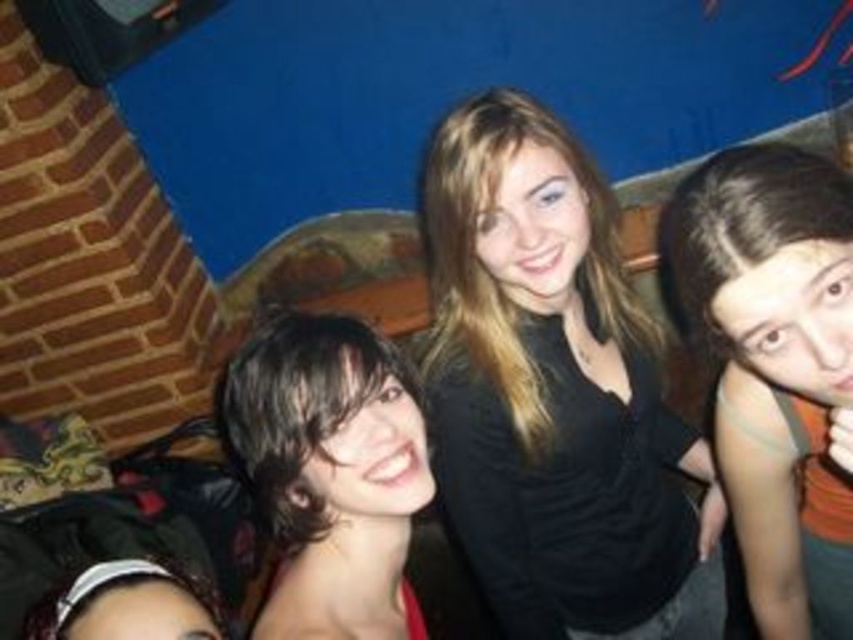
You are at a party and want to find the person with dark brown hair at right. Which direction should you look from the person with matte black hair at lower left?

The dark brown hair at right is located to the right of the matte black hair at lower left, so you should look to the right direction from the matte black hair at lower left to find the dark brown hair at right.

You are standing in the room and want to take a photo of the dark brown hair at right. Where should you aim your camera to capture it?

You should aim your camera at point 0.575 on the horizontal axis and 0.911 on the vertical axis to capture the dark brown hair at right.

You are a photographer trying to adjust the focus of your camera to capture the black matte shirt at center and the dark brown hair at center. Which object should you focus on first to ensure it appears sharp in the photo?

The black matte shirt at center is further to the viewer than the dark brown hair at center, so you should focus on the black matte shirt at center first to ensure it appears sharp.